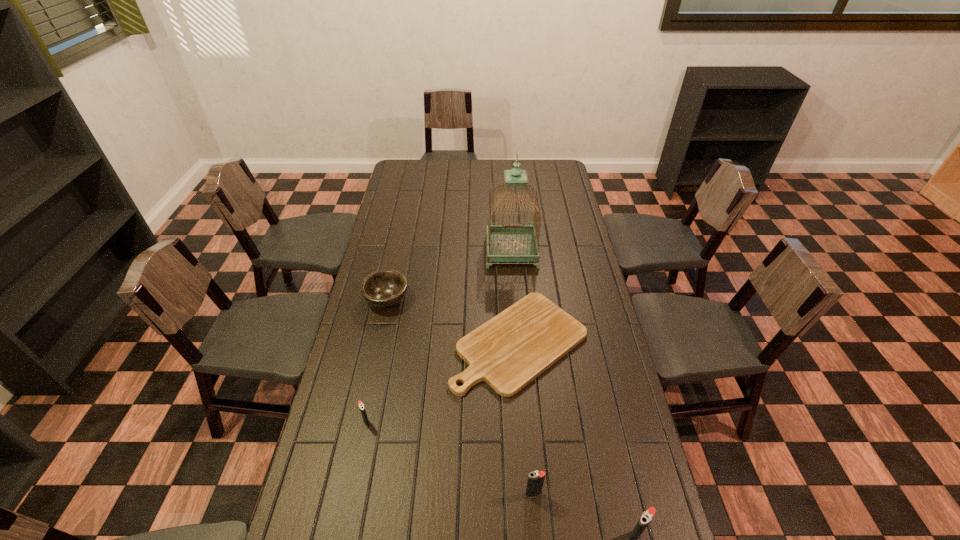
Find the location of a particular element. Image resolution: width=960 pixels, height=540 pixels. free region located 0.080m on the back of the chopping board is located at coordinates [515, 282].

Locate an element on the screen. vacant area located 0.050m on the right of the bowl is located at coordinates (422, 300).

The width and height of the screenshot is (960, 540). Identify the location of vacant space located 0.080m at the door of the tallest object. (514, 282).

Identify the location of igniter situated at the left edge. This screenshot has height=540, width=960. (361, 405).

Locate an element on the screen. The height and width of the screenshot is (540, 960). bowl that is positioned at the left edge is located at coordinates (385, 288).

Locate an element on the screen. This screenshot has width=960, height=540. object situated at the right edge is located at coordinates (510, 350).

In the image, there is a desktop. Identify the location of free space at the far edge. (459, 162).

In the image, there is a desktop. Where is `vacant space at the near edge`? vacant space at the near edge is located at coordinates (477, 528).

Locate an element on the screen. The width and height of the screenshot is (960, 540). vacant space at the left edge of the desktop is located at coordinates click(x=375, y=267).

What are the coordinates of `vacant space at the right edge` in the screenshot? It's located at (568, 251).